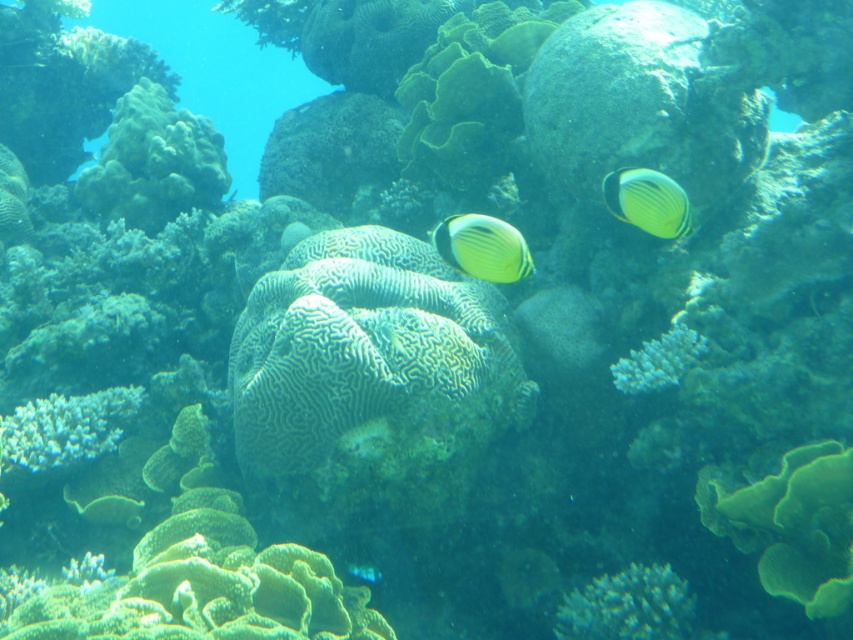
Does yellow matte butterflyfish at center have a lesser height compared to translucent blue fish at lower center?

No, yellow matte butterflyfish at center is not shorter than translucent blue fish at lower center.

I want to click on yellow matte butterflyfish at center, so click(x=482, y=248).

Describe the element at coordinates (482, 248) in the screenshot. This screenshot has height=640, width=853. I see `yellow matte butterflyfish at center` at that location.

Find the location of `yellow matte butterflyfish at center`. yellow matte butterflyfish at center is located at coordinates (482, 248).

Describe the element at coordinates (647, 202) in the screenshot. The image size is (853, 640). I see `yellow matte butterflyfish at upper right` at that location.

Locate an element on the screen. yellow matte butterflyfish at upper right is located at coordinates (647, 202).

Measure the distance between yellow matte butterflyfish at center and white coral at center.

51.72 centimeters

Identify the location of yellow matte butterflyfish at center. (482, 248).